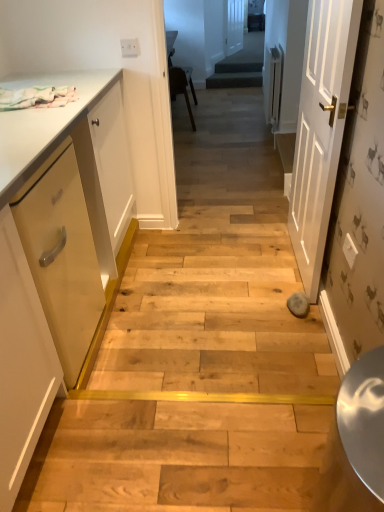
Locate an element on the screen. This screenshot has width=384, height=512. blank area beneath white painted wood door at center right, acting as the second door starting from the top (from a real-world perspective) is located at coordinates (292, 254).